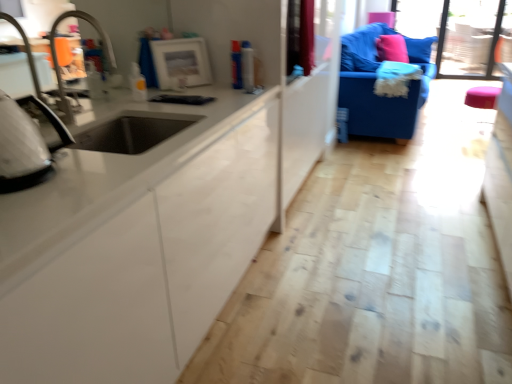
At what (x,y) coordinates should I click in order to perform the action: click on blue fabric couch at upper right. Please return your answer as a coordinate pair (x, y). This screenshot has height=384, width=512. Looking at the image, I should click on (374, 82).

At what (x,y) coordinates should I click in order to perform the action: click on matte white frame at upper center, placed as the second appliance when sorted from left to right. Please return your answer as a coordinate pair (x, y). Image resolution: width=512 pixels, height=384 pixels. Looking at the image, I should click on (181, 63).

Find the location of a particular element. This screenshot has width=512, height=384. white glossy iron at left, the 2th appliance in the right-to-left sequence is located at coordinates (26, 144).

The height and width of the screenshot is (384, 512). In order to click on pink fabric pillow at upper right in this screenshot , I will do click(x=392, y=48).

This screenshot has height=384, width=512. What do you see at coordinates (458, 33) in the screenshot?
I see `transparent glass window screen at upper right` at bounding box center [458, 33].

Identify the location of blue fabric couch at upper right. The height and width of the screenshot is (384, 512). (374, 82).

Is point (28, 162) positioned after point (60, 77)?

That is False.

Between white glossy iron at left, the 2th appliance in the back-to-front sequence, and brushed metal faucet at left, which one has more height?

brushed metal faucet at left is taller.

Are white glossy iron at left, which ranks as the 2th appliance in top-to-bottom order, and brushed metal faucet at left far apart?

Yes, white glossy iron at left, which ranks as the 2th appliance in top-to-bottom order, and brushed metal faucet at left are quite far apart.

From the image's perspective, which object appears higher, white glossy iron at left, the 2th appliance in the back-to-front sequence, or brushed metal faucet at left?

brushed metal faucet at left, from the image's perspective.

From a real-world perspective, who is located higher, transparent glass window screen at upper right or pink fabric pillow at upper right?

pink fabric pillow at upper right, from a real-world perspective.

From the image's perspective, is transparent glass window screen at upper right above or below pink fabric pillow at upper right?

transparent glass window screen at upper right is situated higher than pink fabric pillow at upper right in the image.

The width and height of the screenshot is (512, 384). I want to click on pillow below the transparent glass window screen at upper right (from the image's perspective), so click(x=392, y=48).

Can you confirm if transparent glass window screen at upper right is smaller than pink fabric pillow at upper right?

Incorrect, transparent glass window screen at upper right is not smaller in size than pink fabric pillow at upper right.

Which appliance is the 2nd one when counting from the right side of the brushed metal faucet at left? Please provide its 2D coordinates.

[(181, 63)]

Does matte white frame at upper center, the first appliance from the back, turn towards brushed metal faucet at left?

No, matte white frame at upper center, the first appliance from the back, is not aimed at brushed metal faucet at left.

Which object is thinner, matte white frame at upper center, which ranks as the 2th appliance in front-to-back order, or brushed metal faucet at left?

Thinner between the two is matte white frame at upper center, which ranks as the 2th appliance in front-to-back order.

Where is `pillow located on the right of white glossy iron at left, which is the first appliance from front to back`? pillow located on the right of white glossy iron at left, which is the first appliance from front to back is located at coordinates (392, 48).

Is white glossy iron at left, the 2th appliance in the back-to-front sequence, at the back of pink fabric pillow at upper right?

pink fabric pillow at upper right is not turned away from white glossy iron at left, the 2th appliance in the back-to-front sequence.

Between pink fabric pillow at upper right and white glossy iron at left, the 2th appliance in the right-to-left sequence, which one has less height?

white glossy iron at left, the 2th appliance in the right-to-left sequence, is shorter.

Based on the photo, does blue fabric couch at upper right have a greater height compared to pink fabric pillow at upper right?

Indeed, blue fabric couch at upper right has a greater height compared to pink fabric pillow at upper right.

Is blue fabric couch at upper right further to camera compared to pink fabric pillow at upper right?

That is False.

Is blue fabric couch at upper right inside or outside of pink fabric pillow at upper right?

blue fabric couch at upper right is outside pink fabric pillow at upper right.

Does point (411, 50) come closer to viewer compared to point (384, 37)?

No, (411, 50) is behind (384, 37).

Does brushed metal faucet at left have a greater width compared to matte white frame at upper center, which ranks as the first appliance in right-to-left order?

Indeed, brushed metal faucet at left has a greater width compared to matte white frame at upper center, which ranks as the first appliance in right-to-left order.

This screenshot has width=512, height=384. Find the location of `faucet on the left of matte white frame at upper center, which ranks as the 2th appliance in front-to-back order`. faucet on the left of matte white frame at upper center, which ranks as the 2th appliance in front-to-back order is located at coordinates (56, 54).

Is brushed metal faucet at left to the left of matte white frame at upper center, which ranks as the 2th appliance in front-to-back order, from the viewer's perspective?

Indeed, brushed metal faucet at left is positioned on the left side of matte white frame at upper center, which ranks as the 2th appliance in front-to-back order.

Considering the relative sizes of brushed metal faucet at left and matte white frame at upper center, arranged as the 1th appliance when viewed from the top, in the image provided, is brushed metal faucet at left shorter than matte white frame at upper center, arranged as the 1th appliance when viewed from the top,?

In fact, brushed metal faucet at left may be taller than matte white frame at upper center, arranged as the 1th appliance when viewed from the top.

How different are the orientations of white glossy iron at left, the 2th appliance in the back-to-front sequence, and blue fabric couch at upper right in degrees?

The angle between the facing direction of white glossy iron at left, the 2th appliance in the back-to-front sequence, and the facing direction of blue fabric couch at upper right is 2.29 degrees.

Relative to blue fabric couch at upper right, is white glossy iron at left, which ranks as the 2th appliance in top-to-bottom order, in front or behind?

white glossy iron at left, which ranks as the 2th appliance in top-to-bottom order, is positioned closer to the viewer than blue fabric couch at upper right.

Which object is positioned more to the left, white glossy iron at left, the first appliance from the left, or blue fabric couch at upper right?

Positioned to the left is white glossy iron at left, the first appliance from the left.

Find the location of a particular element. appliance that is the 2nd one when counting leftward from the blue fabric couch at upper right is located at coordinates [x=26, y=144].

Where is `appliance in front of the brushed metal faucet at left`? appliance in front of the brushed metal faucet at left is located at coordinates (26, 144).

Image resolution: width=512 pixels, height=384 pixels. Find the location of `window screen above the pink fabric pillow at upper right (from the image's perspective)`. window screen above the pink fabric pillow at upper right (from the image's perspective) is located at coordinates click(x=458, y=33).

When comparing their distances from white glossy iron at left, which ranks as the 2th appliance in top-to-bottom order, does blue fabric couch at upper right or pink fabric pillow at upper right seem further?

pink fabric pillow at upper right is further to white glossy iron at left, which ranks as the 2th appliance in top-to-bottom order.

Estimate the real-world distances between objects in this image. Which object is closer to blue fabric couch at upper right, brushed metal faucet at left or matte white frame at upper center, arranged as the 1th appliance when viewed from the top?

matte white frame at upper center, arranged as the 1th appliance when viewed from the top.

Considering their positions, is transparent glass window screen at upper right positioned closer to matte white frame at upper center, the first appliance from the back, than brushed metal faucet at left?

Based on the image, brushed metal faucet at left appears to be nearer to matte white frame at upper center, the first appliance from the back.

Based on their spatial positions, is transparent glass window screen at upper right or brushed metal faucet at left closer to white glossy iron at left, the 1th appliance positioned from the bottom?

Among the two, brushed metal faucet at left is located nearer to white glossy iron at left, the 1th appliance positioned from the bottom.

Estimate the real-world distances between objects in this image. Which object is closer to transparent glass window screen at upper right, brushed metal faucet at left or white glossy iron at left, the first appliance from the left?

brushed metal faucet at left is positioned closer to the anchor transparent glass window screen at upper right.

Looking at the image, which one is located closer to pink fabric pillow at upper right, transparent glass window screen at upper right or matte white frame at upper center, which ranks as the 2th appliance in front-to-back order?

transparent glass window screen at upper right is closer to pink fabric pillow at upper right.

Estimate the real-world distances between objects in this image. Which object is closer to pink fabric pillow at upper right, white glossy iron at left, the first appliance from the left, or blue fabric couch at upper right?

blue fabric couch at upper right is closer to pink fabric pillow at upper right.

Which object lies further to the anchor point pink fabric pillow at upper right, brushed metal faucet at left or transparent glass window screen at upper right?

brushed metal faucet at left lies further to pink fabric pillow at upper right than the other object.

I want to click on pillow between matte white frame at upper center, which ranks as the first appliance in right-to-left order, and transparent glass window screen at upper right in the front-back direction, so click(392, 48).

Locate an element on the screen. Image resolution: width=512 pixels, height=384 pixels. studio couch located between matte white frame at upper center, which ranks as the first appliance in right-to-left order, and pink fabric pillow at upper right in the depth direction is located at coordinates (374, 82).

The width and height of the screenshot is (512, 384). In order to click on pillow between brushed metal faucet at left and transparent glass window screen at upper right along the z-axis in this screenshot , I will do pyautogui.click(x=392, y=48).

Identify the location of pillow located between white glossy iron at left, which is the first appliance from front to back, and transparent glass window screen at upper right in the depth direction. (392, 48).